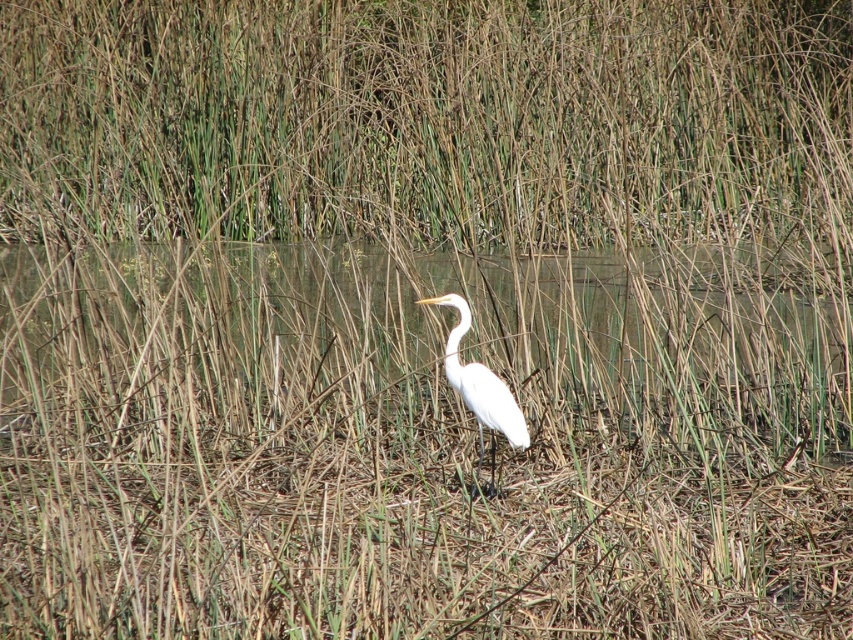
Is clear water at center behind white smooth heron at center?

Yes, it is.

Locate an element on the screen. The image size is (853, 640). clear water at center is located at coordinates (419, 342).

Image resolution: width=853 pixels, height=640 pixels. I want to click on clear water at center, so click(x=419, y=342).